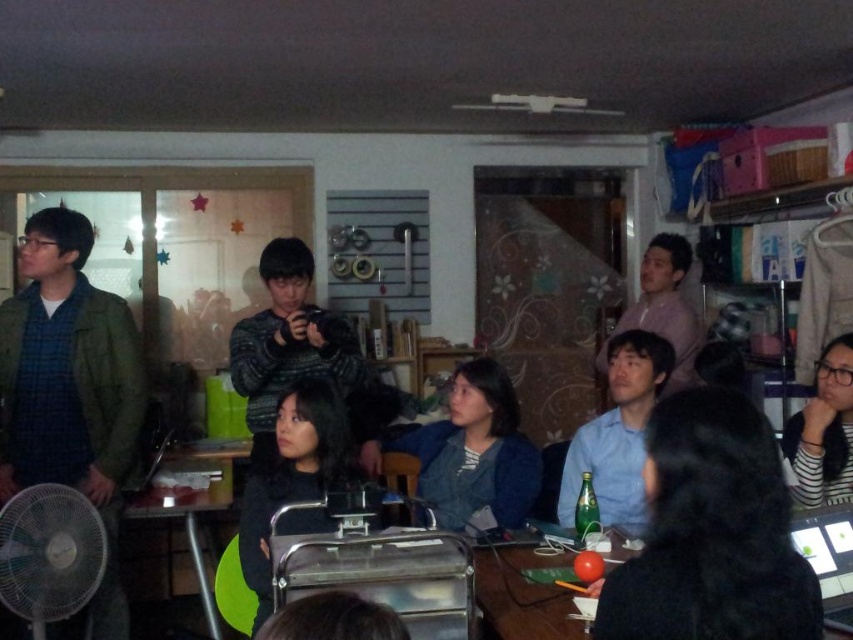
Question: Estimate the real-world distances between objects in this image. Which object is closer to the matte black table at center?

Choices:
 (A) black matte shirt at center
 (B) dark gray sweater at center

Answer: (B)

Question: Does dark gray sweater at center have a greater width compared to black striped shirt at lower right?

Choices:
 (A) yes
 (B) no

Answer: (A)

Question: Is black matte shirt at center below dark gray sweater at center?

Choices:
 (A) yes
 (B) no

Answer: (B)

Question: Does dark gray sweater at center appear on the left side of matte black table at center?

Choices:
 (A) no
 (B) yes

Answer: (B)

Question: Which point is farther to the camera?

Choices:
 (A) (502, 636)
 (B) (97, 531)
 (C) (347, 448)
 (D) (660, 595)

Answer: (C)

Question: Which object is farther from the camera taking this photo?

Choices:
 (A) dark gray sweater at center
 (B) black plastic fan at lower left

Answer: (B)